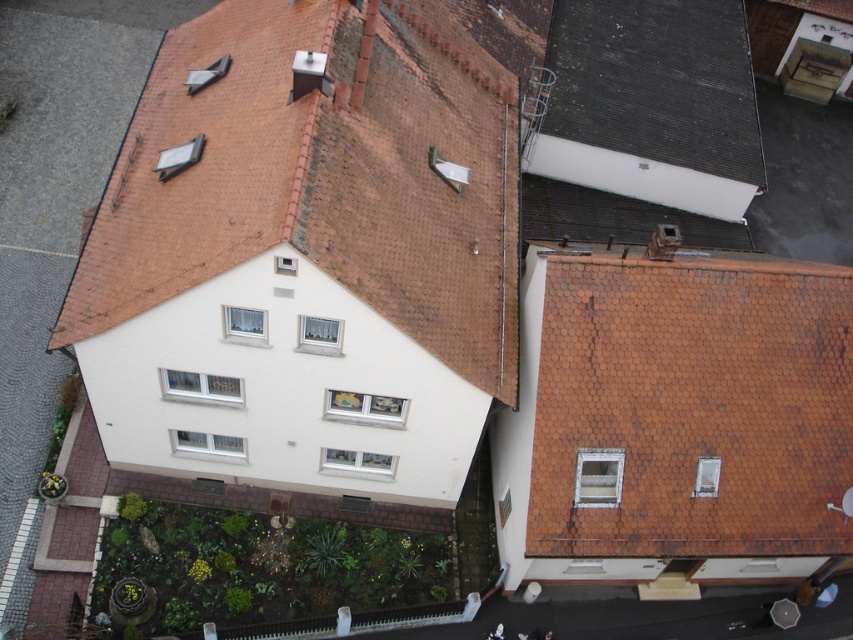
You are standing in front of the residential building and want to take a photo. There are two points marked in the image, point 1 at coordinates point (120,305) and point 2 at coordinates point (730,170). Which point will appear larger in the photo?

Point (120,305) is closer to the camera than point (730,170), so it will appear larger in the photo.

You are standing in the garden in front of the residential building. You want to estimate how far the brown tile roof at upper center is from your current position. What is the approximate distance?

The brown tile roof at upper center is approximately 22.92 meters away from the viewer, so the distance is about 22.92 meters.

You are a drone operator flying over the residential building. You notice two features on the roof at upper center. Which one is larger in size between the brown tile roof at upper center and the black shingles at upper center?

The brown tile roof at upper center is bigger than the black shingles at upper center.